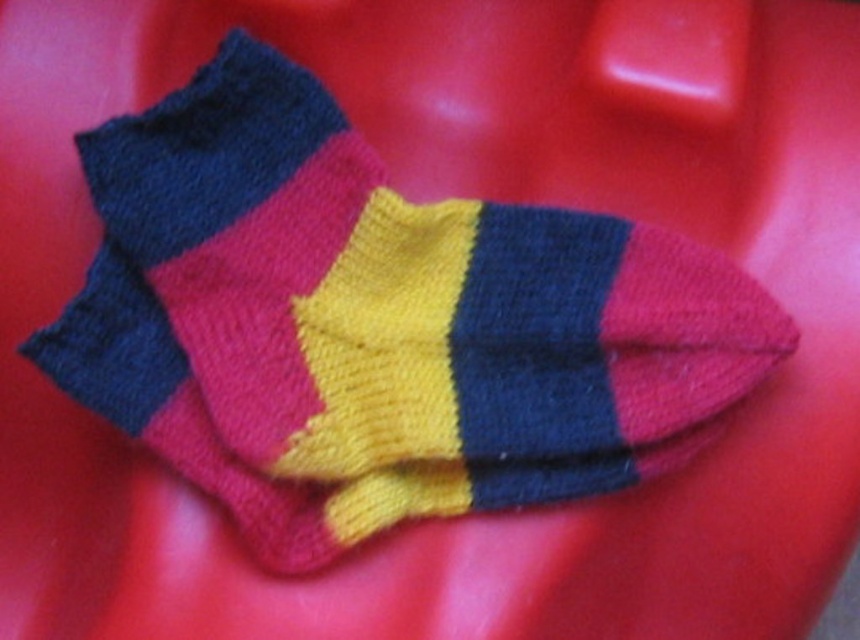
You are standing in front of the image of knitted socks on a red surface. You notice a specific point labeled as point (x=395, y=296). Can you identify what object this point is pointing to?

The point (x=395, y=296) corresponds to the knitted wool socks at center.

You are organizing a sock drawer and notice two items labeled knitted wool socks at center and knitted wool sock at center. Which one is closer to you?

The knitted wool socks at center is closer to you because it is in front of the knitted wool sock at center.